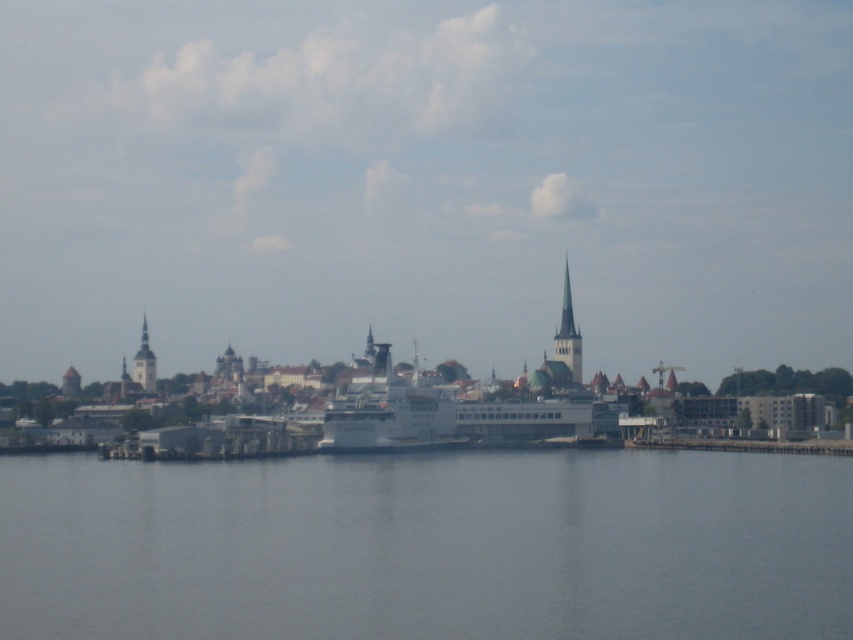
Which is behind, point (334, 445) or point (148, 362)?

The point (148, 362) is behind.

Which is in front, point (366, 388) or point (142, 378)?

Point (366, 388) is in front.

I want to click on white matte ship at center, so click(x=387, y=412).

What are the coordinates of `white matte ship at center` in the screenshot? It's located at (387, 412).

Can you confirm if green stone spire at center is positioned to the left of green stone tower at center?

Correct, you'll find green stone spire at center to the left of green stone tower at center.

Who is positioned more to the right, green stone spire at center or green stone tower at center?

green stone tower at center is more to the right.

Does point (556, 348) come behind point (563, 326)?

That is False.

The height and width of the screenshot is (640, 853). Identify the location of green stone spire at center. (561, 349).

Who is more forward, (x=566, y=387) or (x=154, y=362)?

Point (x=566, y=387)

Is point (579, 344) behind point (141, 355)?

No, (579, 344) is in front of (141, 355).

Locate an element on the screen. The height and width of the screenshot is (640, 853). green stone spire at center is located at coordinates (561, 349).